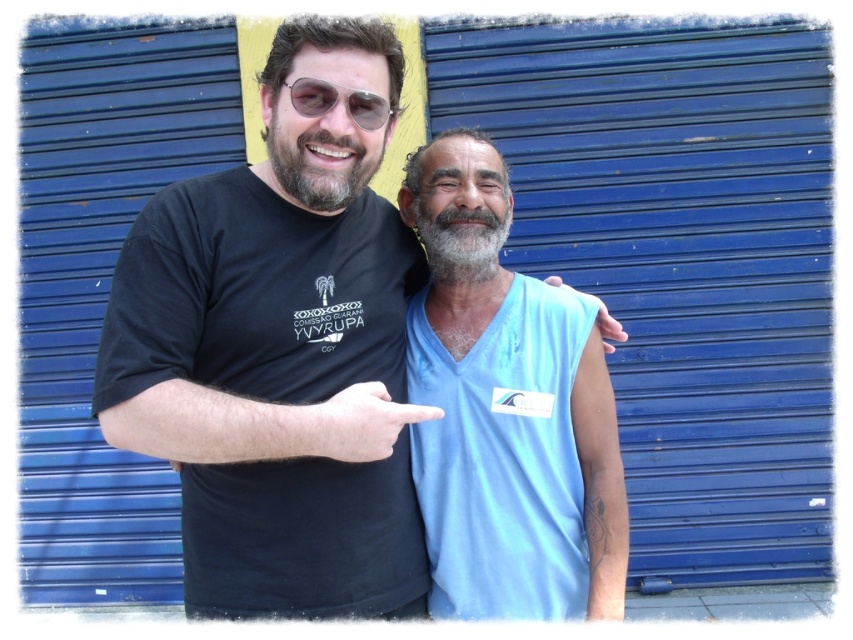
You are standing in front of the two people in the image. You want to place a small sticker exactly at the position of point (x=468, y=280) and point (x=364, y=396). Which point is closer to you?

Point (x=364, y=396) is closer to you because it is in front of point (x=468, y=280).

You are a fashion designer observing the two people in the image. You need to determine which piece of clothing has a larger surface area between the light blue fabric at center and the blue fabric sleeve at upper right. Which one is bigger?

The light blue fabric at center is bigger than the blue fabric sleeve at upper right, so the light blue fabric at center has a larger surface area.

You are an observer looking at the image. There is a point at coordinates (335, 100). What object in the scene is located exactly at that point?

The matte black sunglasses at upper center is located exactly at point (335, 100).